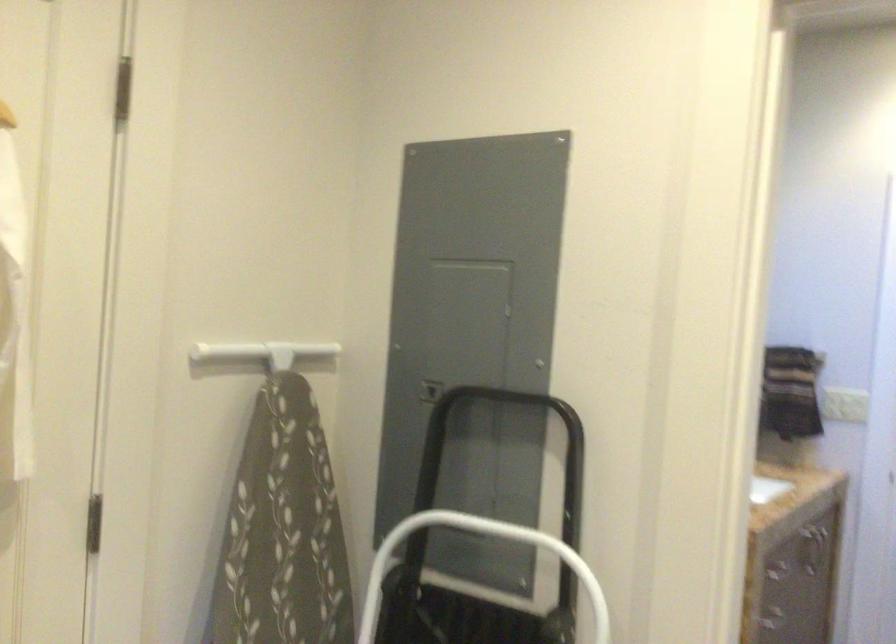
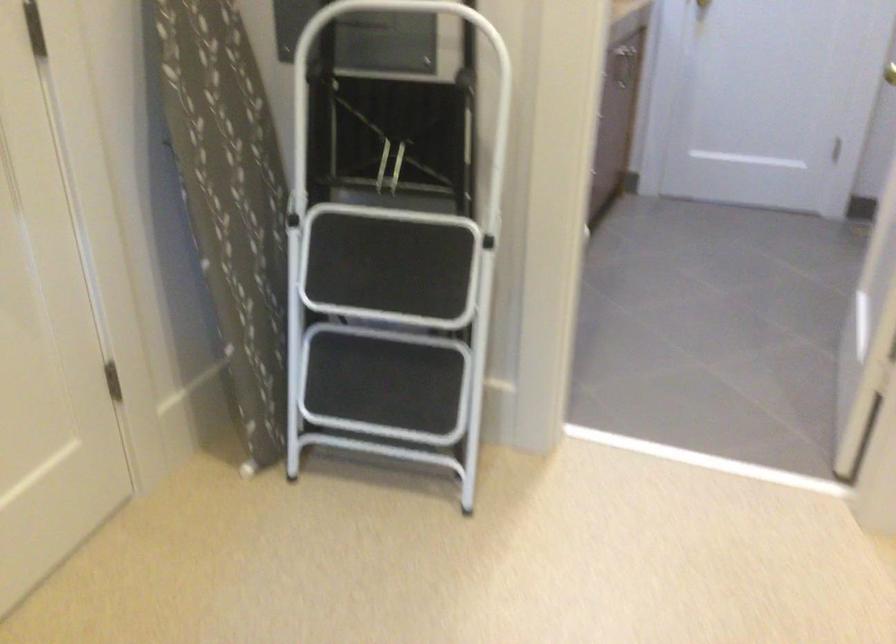
In the second image, find the point that corresponds to pixel 478 527 in the first image.

(378, 13)